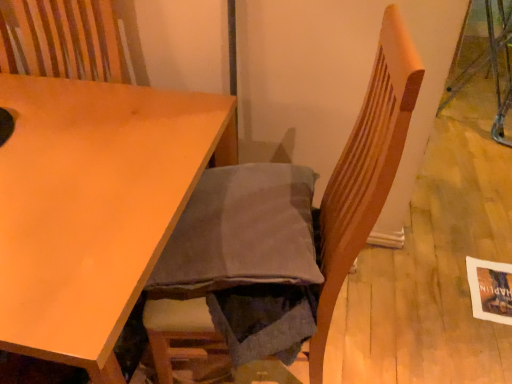
At what (x,y) coordinates should I click in order to perform the action: click on free point above matte wood table at center (from a real-world perspective). Please return your answer as a coordinate pair (x, y). The width and height of the screenshot is (512, 384). Looking at the image, I should click on (69, 151).